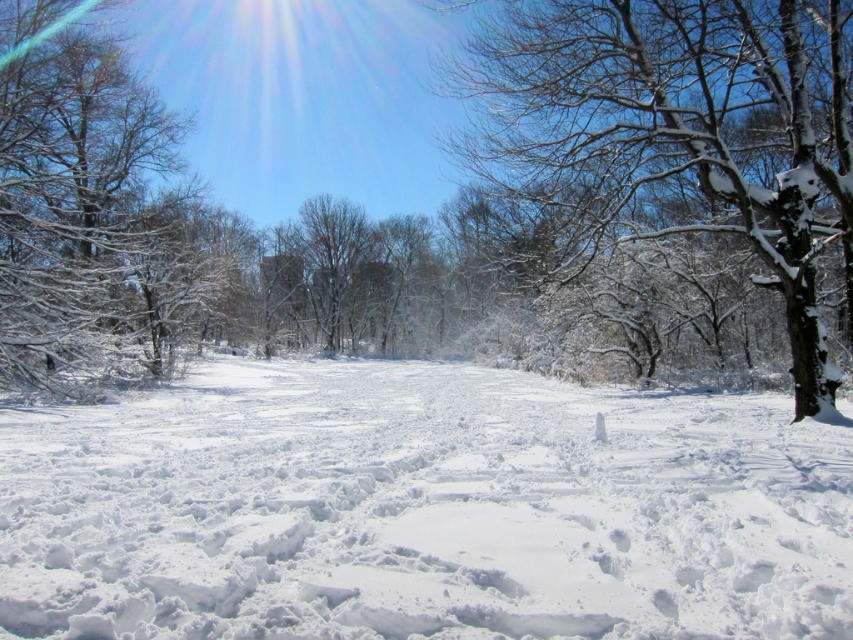
Question: Based on their relative distances, which object is nearer to the snow-covered tree at right?

Choices:
 (A) snow-covered branches at left
 (B) white fluffy snow at center

Answer: (B)

Question: Does white fluffy snow at center appear over snow-covered tree at right?

Choices:
 (A) yes
 (B) no

Answer: (B)

Question: Which point is farther from the camera taking this photo?

Choices:
 (A) (715, 564)
 (B) (32, 314)
 (C) (849, 6)

Answer: (B)

Question: Estimate the real-world distances between objects in this image. Which object is farther from the snow-covered tree at right?

Choices:
 (A) white fluffy snow at center
 (B) snow-covered branches at left

Answer: (B)

Question: Is white fluffy snow at center to the left of snow-covered tree at right from the viewer's perspective?

Choices:
 (A) yes
 (B) no

Answer: (A)

Question: Observing the image, what is the correct spatial positioning of snow-covered tree at right in reference to snow-covered branches at left?

Choices:
 (A) right
 (B) left

Answer: (A)